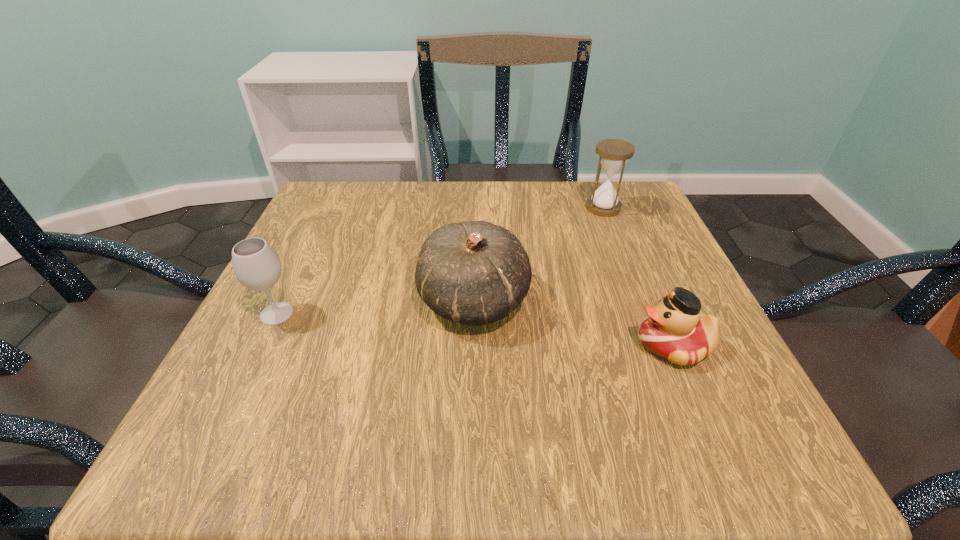
Locate an element on the screen. This screenshot has width=960, height=540. hourglass is located at coordinates (613, 154).

Where is `the second object from left to right`? Image resolution: width=960 pixels, height=540 pixels. the second object from left to right is located at coordinates (474, 273).

At what (x,y) coordinates should I click in order to perform the action: click on wineglass. Please return your answer as a coordinate pair (x, y). The height and width of the screenshot is (540, 960). Looking at the image, I should click on (256, 265).

Where is `the shortest object`? This screenshot has width=960, height=540. the shortest object is located at coordinates (674, 330).

Identify the location of vacant space located on the front of the farthest object. The image size is (960, 540). (633, 283).

Where is `free location located 0.120m on the back of the second object from left to right`? The height and width of the screenshot is (540, 960). free location located 0.120m on the back of the second object from left to right is located at coordinates (475, 230).

The image size is (960, 540). Identify the location of free spot located on the back of the leftmost object. (319, 226).

The height and width of the screenshot is (540, 960). In order to click on vacant space located on the face of the duck in this screenshot , I will do click(435, 346).

I want to click on free space located on the face of the duck, so click(579, 346).

This screenshot has width=960, height=540. In order to click on free space located on the face of the duck in this screenshot , I will do `click(535, 346)`.